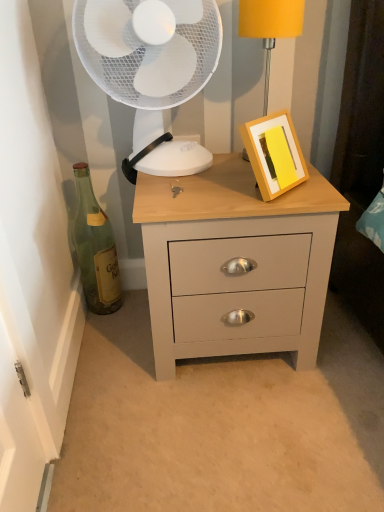
Find the location of a particular element. This screenshot has height=512, width=384. vacant region above matte gray chest of drawers at center (from a real-world perspective) is located at coordinates (217, 182).